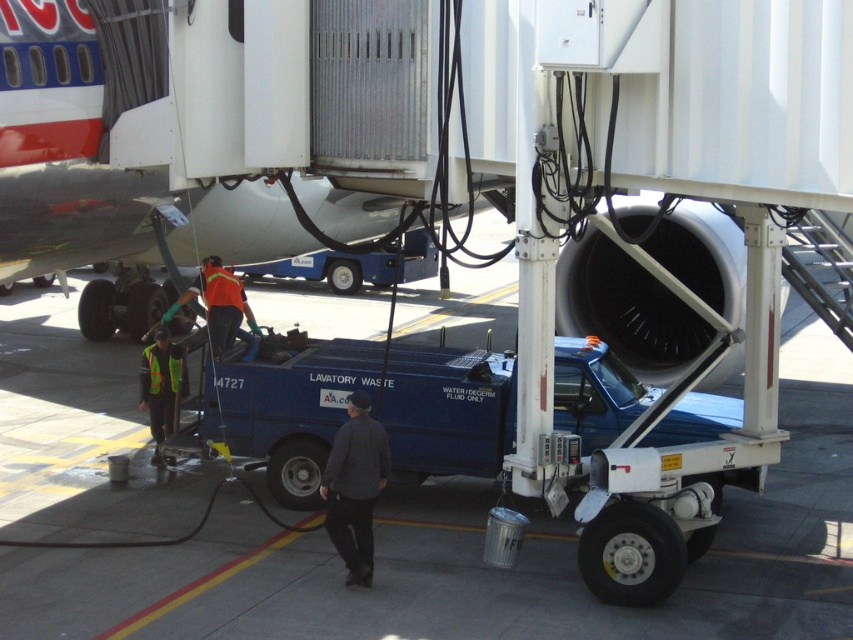
Can you confirm if blue metallic truck at lower center is smaller than metallic silver airplane at upper left?

No.

Image resolution: width=853 pixels, height=640 pixels. In order to click on blue metallic truck at lower center in this screenshot , I will do `click(480, 557)`.

Is point (155, 4) more distant than point (161, 392)?

No, it is in front of (161, 392).

Measure the distance between metallic silver airplane at upper left and camera.

They are 14.97 meters apart.

Is point (279, 3) positioned in front of point (166, 422)?

Yes, point (279, 3) is closer to viewer.

Locate an element on the screen. The width and height of the screenshot is (853, 640). metallic silver airplane at upper left is located at coordinates (171, 134).

Between metallic silver airplane at upper left and dark gray sweater at center, which one is positioned higher?

metallic silver airplane at upper left is above.

Is point (314, 221) farther from camera compared to point (349, 433)?

Yes, it is.

Find the location of a particular element. This screenshot has width=853, height=640. metallic silver airplane at upper left is located at coordinates (171, 134).